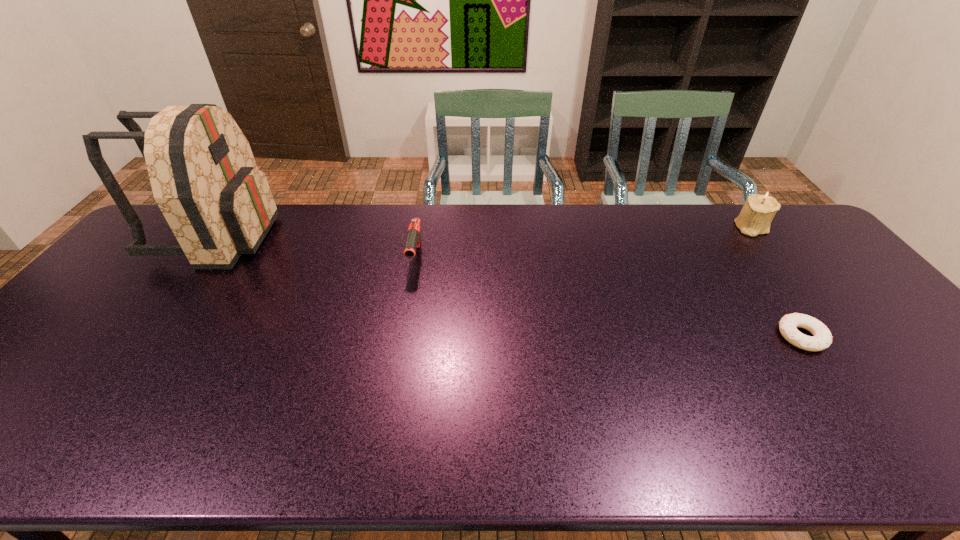
I want to click on free space at the left edge of the desktop, so click(x=157, y=280).

Locate an element on the screen. The height and width of the screenshot is (540, 960). free space at the right edge of the desktop is located at coordinates (840, 287).

Where is `empty location between the candle_holder and the third tallest object`? Image resolution: width=960 pixels, height=540 pixels. empty location between the candle_holder and the third tallest object is located at coordinates (584, 243).

The height and width of the screenshot is (540, 960). Find the location of `free space between the backpack and the third tallest object`. free space between the backpack and the third tallest object is located at coordinates (317, 247).

The width and height of the screenshot is (960, 540). In order to click on free spot between the nearest object and the third shortest object in this screenshot , I will do pos(777,282).

Where is `free space between the shortest object and the backpack`? The image size is (960, 540). free space between the shortest object and the backpack is located at coordinates (510, 286).

Where is `free space that is in between the nearest object and the third shortest object`? The height and width of the screenshot is (540, 960). free space that is in between the nearest object and the third shortest object is located at coordinates pos(777,282).

I want to click on free area in between the third tallest object and the tallest object, so point(317,247).

At what (x,y) coordinates should I click in order to perform the action: click on free spot between the doughnut and the gun. Please return your answer as a coordinate pair (x, y). Looking at the image, I should click on (609, 297).

Where is `empty space between the candle_holder and the doughnut`? empty space between the candle_holder and the doughnut is located at coordinates (777, 282).